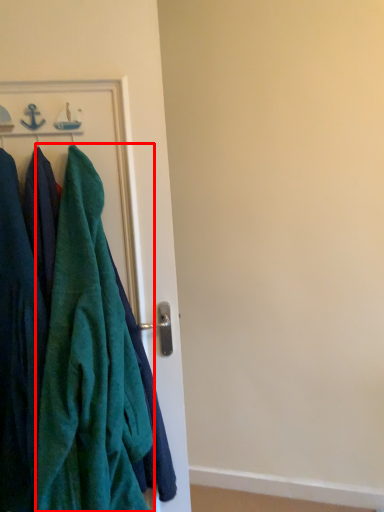
Question: Considering the relative positions of towel (annotated by the red box) and cloak in the image provided, where is towel (annotated by the red box) located with respect to the staircase?

Choices:
 (A) left
 (B) right

Answer: (B)